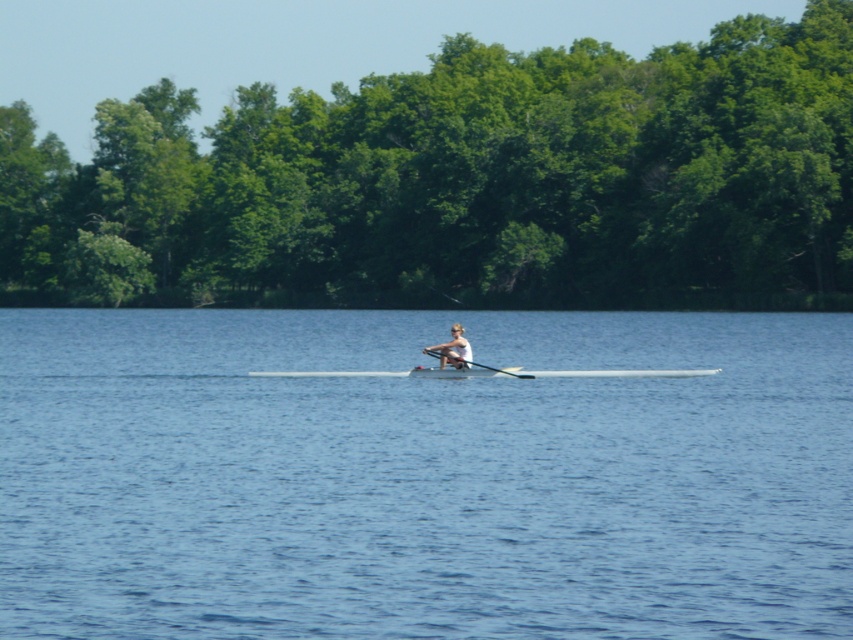
You are standing at the edge of the water and see the point marked as point (422, 476) in the image. What is the color of the water at that point?

The blue water at center is represented by point (422, 476), so the color is blue.

You are standing on the dock and want to throw a lifebuoy to the person in the blue water at center. If the lifebuoy can travel 8 meters, will it reach them?

The distance between the blue water at center and the camera is 10.00 meters. Since the lifebuoy can only travel 8 meters, it will not reach the person in the blue water at center.

From the picture: You are standing on the dock and see the blue water at center and the light brown wooden paddle at center in the boat. Which object is taller?

The blue water at center is taller than the light brown wooden paddle at center.